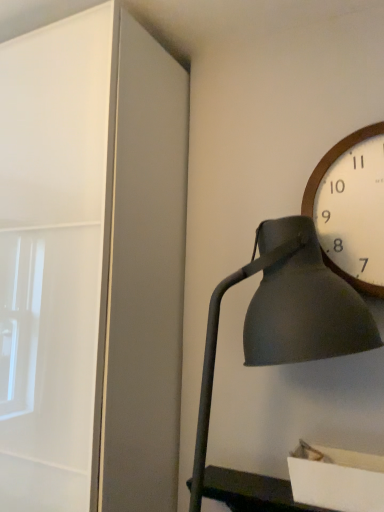
Question: In terms of size, does wooden/textured wall clock at upper right appear bigger or smaller than matte black lamp at right?

Choices:
 (A) big
 (B) small

Answer: (B)

Question: From a real-world perspective, is wooden/textured wall clock at upper right positioned above or below matte black lamp at right?

Choices:
 (A) below
 (B) above

Answer: (B)

Question: From the image's perspective, is wooden/textured wall clock at upper right above or below matte black lamp at right?

Choices:
 (A) above
 (B) below

Answer: (A)

Question: Considering the positions of matte black lamp at right and wooden/textured wall clock at upper right in the image, is matte black lamp at right bigger or smaller than wooden/textured wall clock at upper right?

Choices:
 (A) big
 (B) small

Answer: (A)

Question: Does point (364, 328) appear closer or farther from the camera than point (359, 162)?

Choices:
 (A) farther
 (B) closer

Answer: (B)

Question: Would you say matte black lamp at right is inside or outside wooden/textured wall clock at upper right?

Choices:
 (A) outside
 (B) inside

Answer: (A)

Question: From a real-world perspective, is matte black lamp at right positioned above or below wooden/textured wall clock at upper right?

Choices:
 (A) below
 (B) above

Answer: (A)